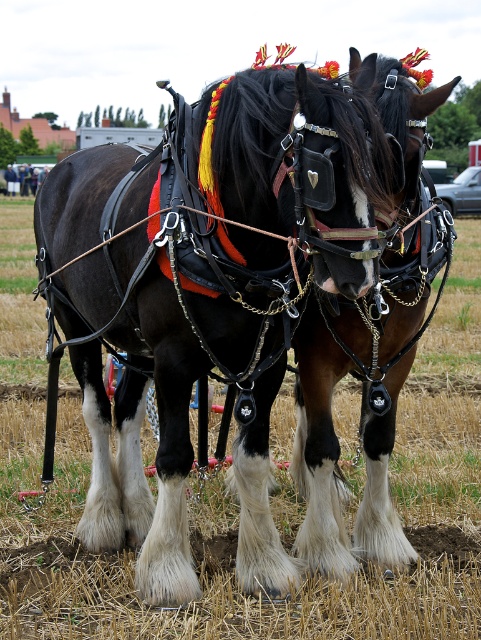
Is black leather horse at center positioned in front of brushed metal water at bottle left?

Yes, it is in front of brushed metal water at bottle left.

Does black leather horse at center have a greater width compared to brushed metal water at bottle left?

Incorrect, black leather horse at center's width does not surpass brushed metal water at bottle left's.

Is point (148, 298) farther from camera compared to point (8, 179)?

No, it is not.

Where is `black leather horse at center`? The width and height of the screenshot is (481, 640). black leather horse at center is located at coordinates click(207, 298).